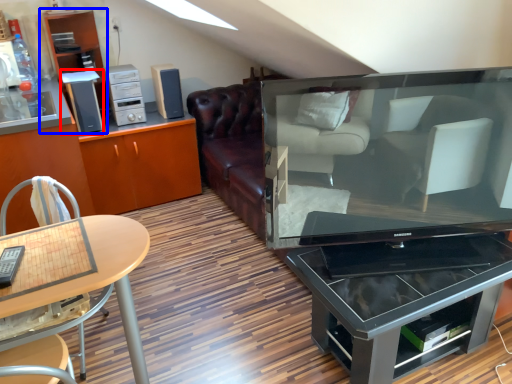
Question: Which of the following is the closest to the observer, appliance (highlighted by a red box) or shelf (highlighted by a blue box)?

Choices:
 (A) appliance
 (B) shelf

Answer: (B)